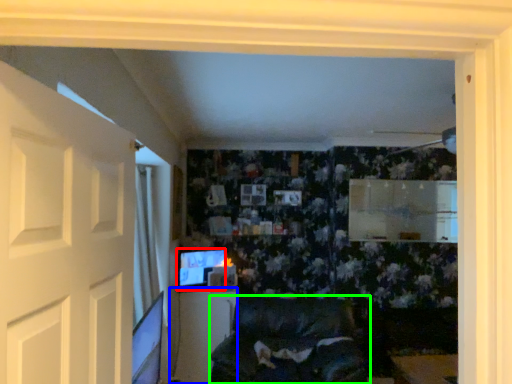
Question: Which object is positioned farthest from computer monitor (highlighted by a red box)? Select from table (highlighted by a blue box) and furniture (highlighted by a green box).

Choices:
 (A) table
 (B) furniture

Answer: (B)